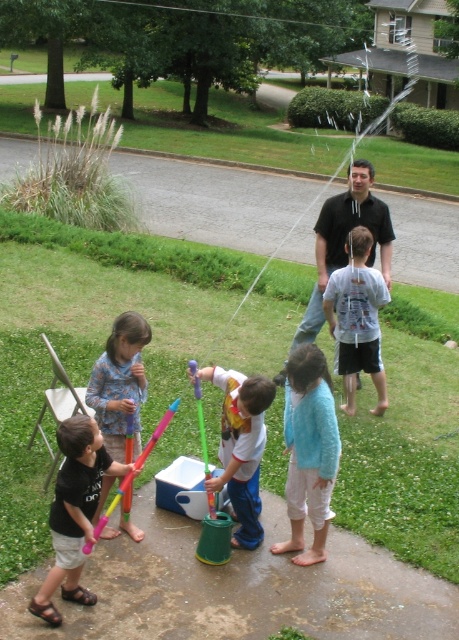
Question: Which object is the closest to the white matte shirt at center?

Choices:
 (A) floral fabric dress at lower left
 (B) matte black shirt at lower left

Answer: (A)

Question: Which is farther from the white matte shirt at center?

Choices:
 (A) white cotton shirt at center
 (B) floral fabric dress at lower left
 (C) matte black shirt at lower left
 (D) light blue sweater at center

Answer: (C)

Question: Which point is farther from the camera taking this photo?

Choices:
 (A) (100, 499)
 (B) (244, 397)

Answer: (B)

Question: Can you confirm if light blue sweater at center is positioned to the left of white cotton shirt at center?

Choices:
 (A) yes
 (B) no

Answer: (B)

Question: Can you confirm if white cotton shirt at center is wider than white matte shirt at center?

Choices:
 (A) no
 (B) yes

Answer: (A)

Question: Does light blue sweater at center have a larger size compared to white cotton shirt at center?

Choices:
 (A) no
 (B) yes

Answer: (A)